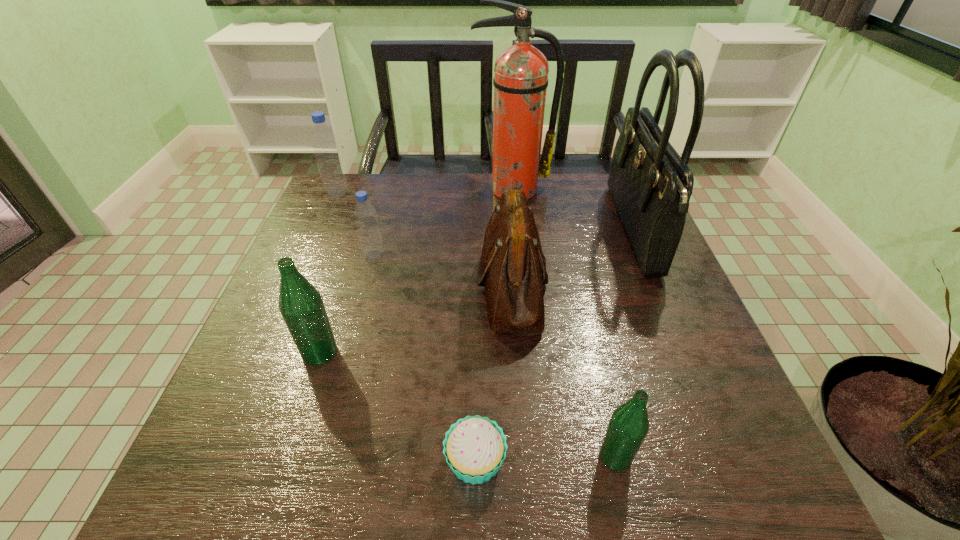
Select which bottle appears as the second closest to the fire extinguisher. Please provide its 2D coordinates. Your answer should be formatted as a tuple, i.e. [(x, y)], where the tuple contains the x and y coordinates of a point satisfying the conditions above.

[(324, 142)]

Choose which bottle is the nearest neighbor to the farther blue bottle. Please provide its 2D coordinates. Your answer should be formatted as a tuple, i.e. [(x, y)], where the tuple contains the x and y coordinates of a point satisfying the conditions above.

[(365, 215)]

Where is `free region that satisfies the following two spatial constraints: 1. on the back side of the brown shoulder bag; 2. on the right side of the left green bottle`? free region that satisfies the following two spatial constraints: 1. on the back side of the brown shoulder bag; 2. on the right side of the left green bottle is located at coordinates (342, 286).

This screenshot has height=540, width=960. I want to click on vacant space that satisfies the following two spatial constraints: 1. on the front side of the rightmost bottle; 2. on the right side of the bigger blue bottle, so click(222, 456).